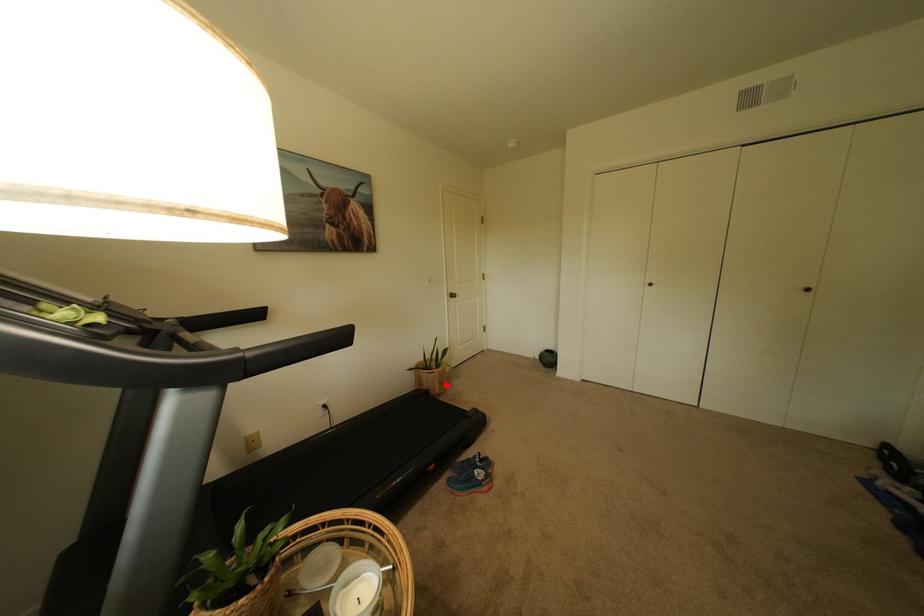
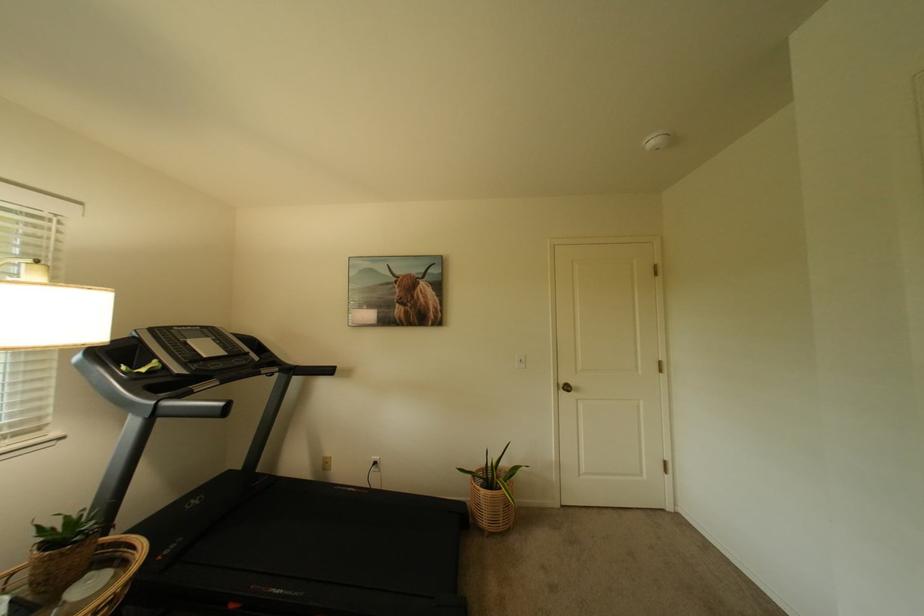
Locate, in the second image, the point that corresponds to the highlighted location in the first image.

(495, 515)